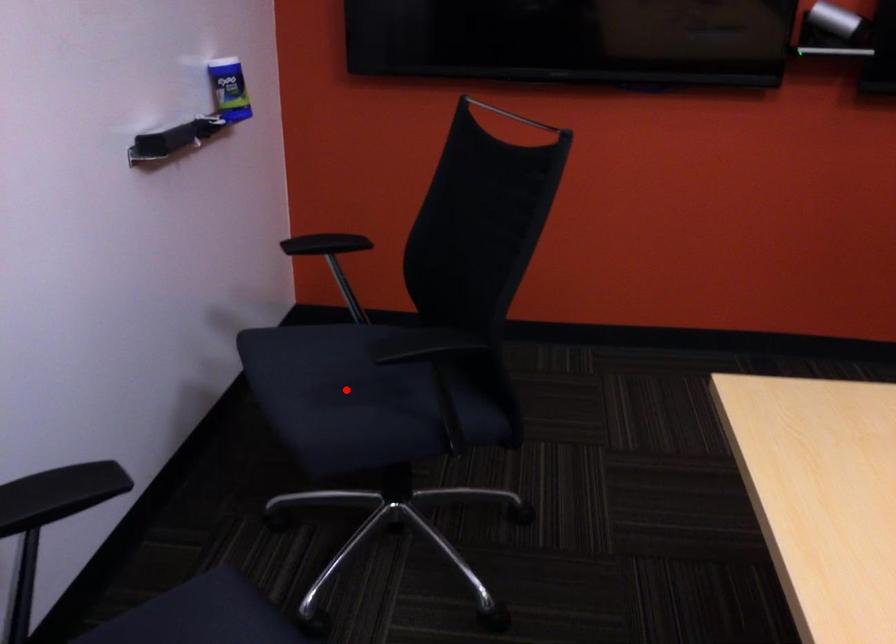
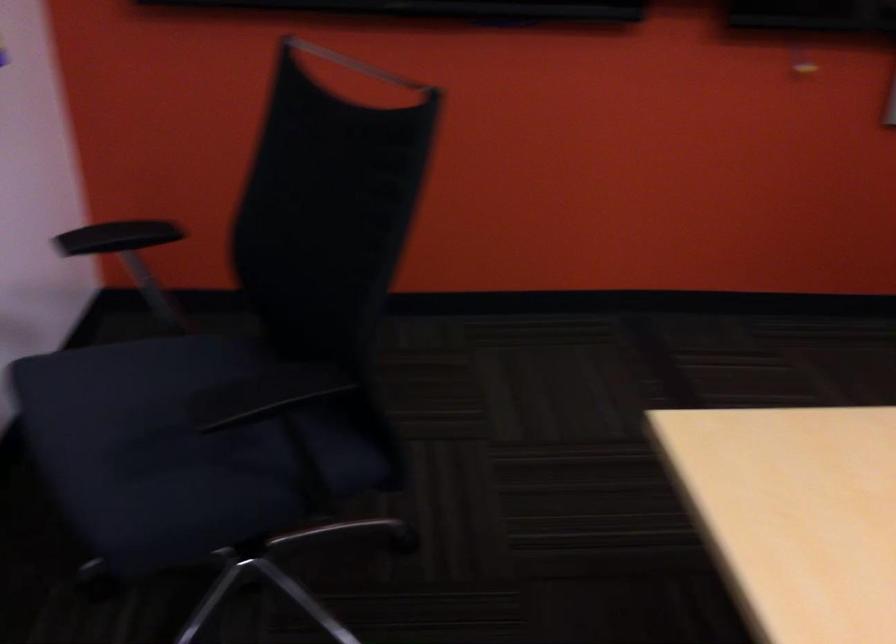
Locate, in the second image, the point that corresponds to the highlighted location in the first image.

(167, 442)